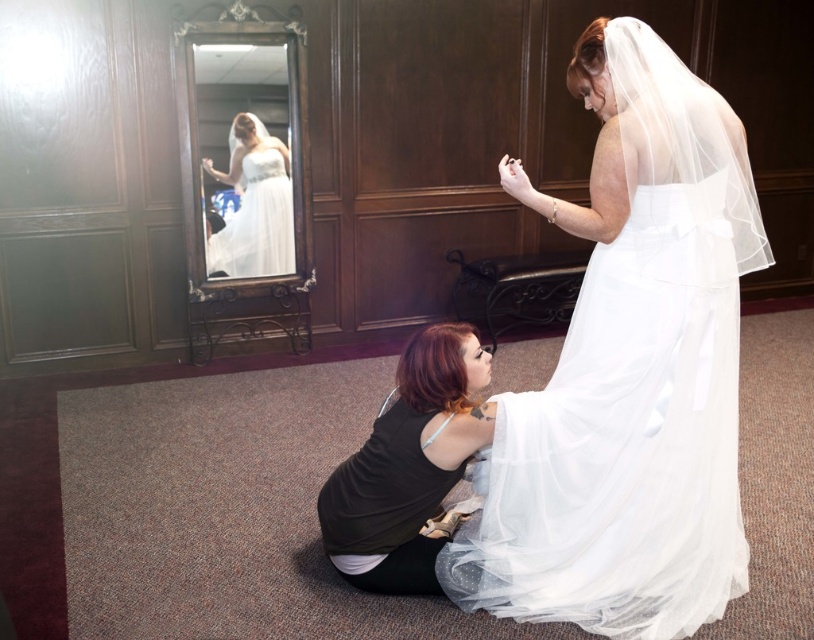
Can you confirm if white tulle dress at lower center is smaller than black matte tank top at lower center?

Incorrect, white tulle dress at lower center is not smaller in size than black matte tank top at lower center.

Between point (718, 372) and point (407, 397), which one is positioned behind?

The point (718, 372) is behind.

Between point (738, 269) and point (407, 388), which one is positioned behind?

Positioned behind is point (738, 269).

This screenshot has height=640, width=814. Find the location of `white tulle dress at lower center`. white tulle dress at lower center is located at coordinates (622, 442).

Based on the photo, can you confirm if white tulle dress at lower center is positioned below white satin dress at center?

Correct, white tulle dress at lower center is located below white satin dress at center.

Describe the element at coordinates (622, 442) in the screenshot. This screenshot has height=640, width=814. I see `white tulle dress at lower center` at that location.

The width and height of the screenshot is (814, 640). In order to click on white tulle dress at lower center in this screenshot , I will do pyautogui.click(x=622, y=442).

Can you confirm if black matte tank top at lower center is positioned to the left of white satin dress at center?

No, black matte tank top at lower center is not to the left of white satin dress at center.

Between black matte tank top at lower center and white satin dress at center, which one appears on the left side from the viewer's perspective?

Positioned to the left is white satin dress at center.

Describe the element at coordinates (409, 467) in the screenshot. I see `black matte tank top at lower center` at that location.

The width and height of the screenshot is (814, 640). In order to click on black matte tank top at lower center in this screenshot , I will do `click(409, 467)`.